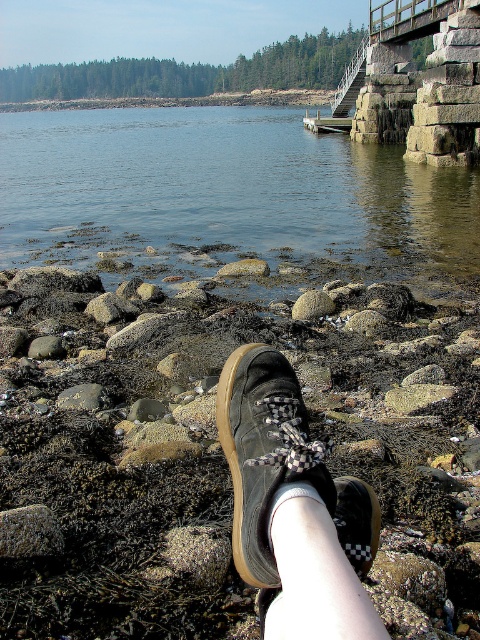
Consider the image. Who is positioned more to the right, rusty stone at lower center or clear water at lower center?

From the viewer's perspective, rusty stone at lower center appears more on the right side.

In the scene shown: Is rusty stone at lower center positioned at the back of clear water at lower center?

No, rusty stone at lower center is in front of clear water at lower center.

Is point (157, 381) closer to camera compared to point (452, 189)?

Yes, point (157, 381) is in front of point (452, 189).

Where is `rusty stone at lower center`? rusty stone at lower center is located at coordinates (218, 456).

Does clear water at lower center come behind black checkered shoe at lower center?

Yes, it is.

You are a GUI agent. You are given a task and a screenshot of the screen. Output one action in this format:
    pyautogui.click(x=<x>, y=<y>)
    Task: Click on the clear water at lower center
    
    Given the screenshot: What is the action you would take?
    pyautogui.click(x=226, y=192)

This screenshot has width=480, height=640. I want to click on clear water at lower center, so click(226, 192).

Can you confirm if rusty stone at lower center is thinner than black checkered shoe at lower center?

No, rusty stone at lower center is not thinner than black checkered shoe at lower center.

Is point (454, 572) farther from camera compared to point (336, 518)?

That is True.

This screenshot has height=640, width=480. Identify the location of rusty stone at lower center. (218, 456).